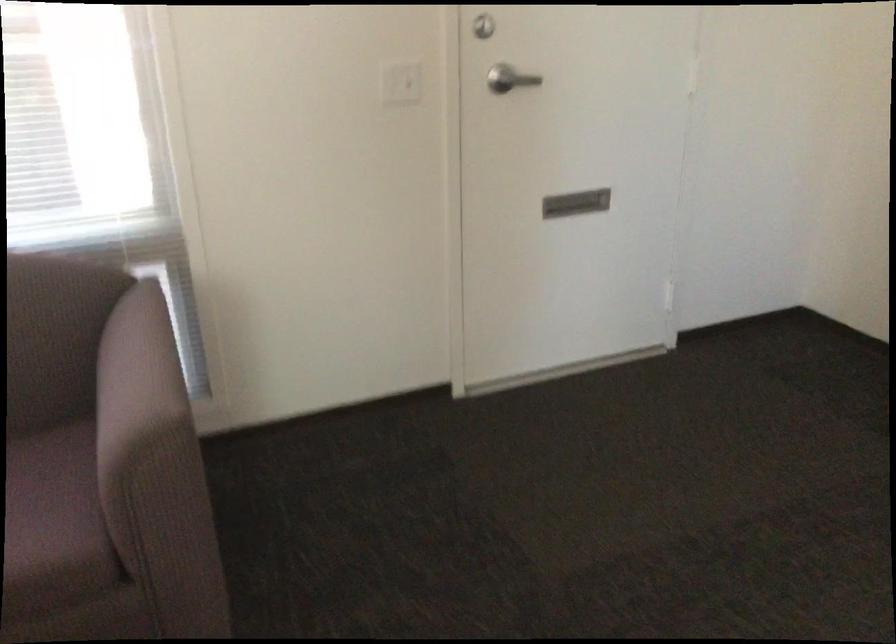
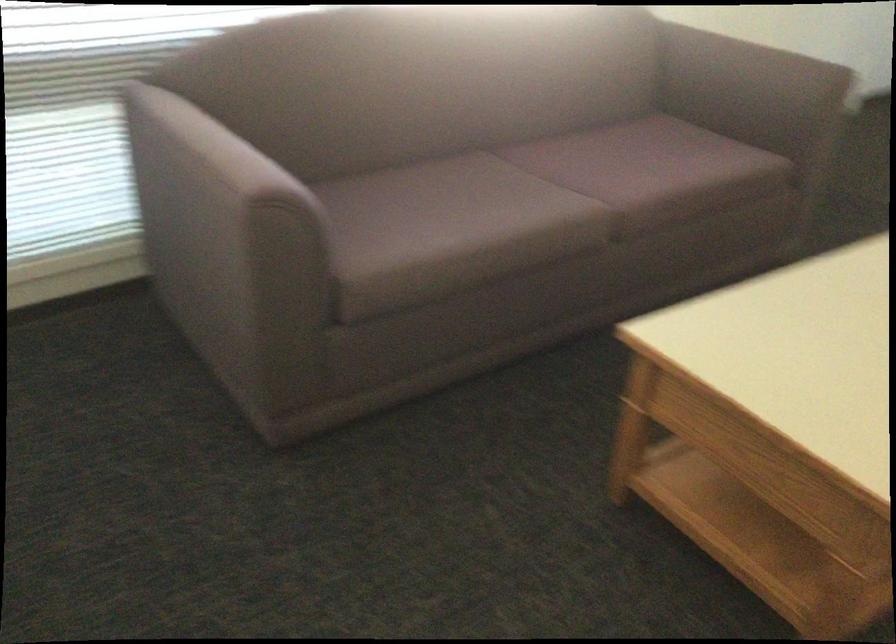
Where in the second image is the point corresponding to point (118, 392) from the first image?

(746, 73)